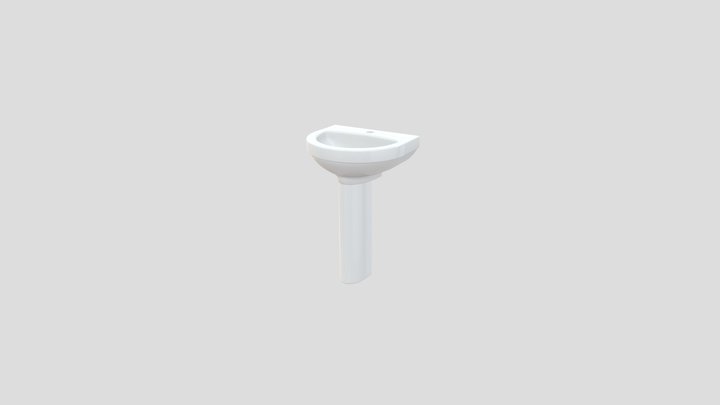
Find the location of a particular element. Image resolution: width=720 pixels, height=405 pixels. blank space above sink is located at coordinates (373, 102).